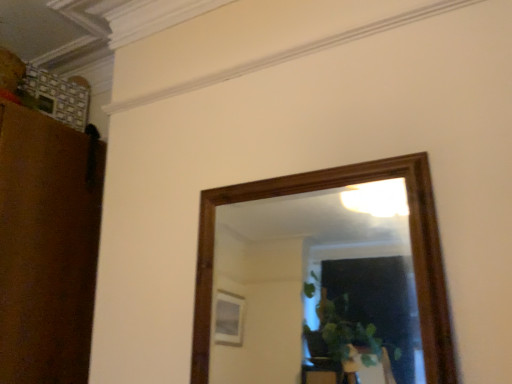
In order to face matte brown cabinet at left, should I rotate leftwards or rightwards?

Rotate your view left by about 31.500°.

Describe the element at coordinates (47, 247) in the screenshot. I see `matte brown cabinet at left` at that location.

At what (x,y) coordinates should I click in order to perform the action: click on matte brown cabinet at left. Please return your answer as a coordinate pair (x, y). This screenshot has width=512, height=384. Looking at the image, I should click on (47, 247).

Find the location of a particular element. The width and height of the screenshot is (512, 384). matte brown cabinet at left is located at coordinates pyautogui.click(x=47, y=247).